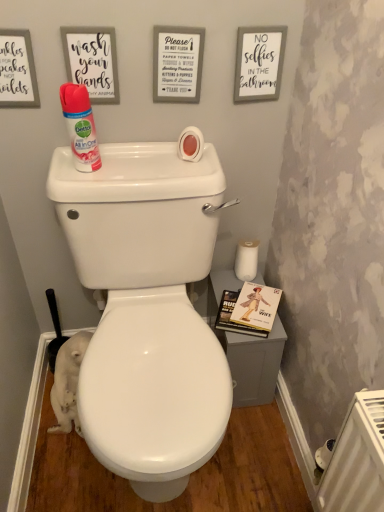
Locate an element on the screen. This screenshot has width=384, height=512. unoccupied region to the right of matte pink spray can at upper left is located at coordinates (147, 173).